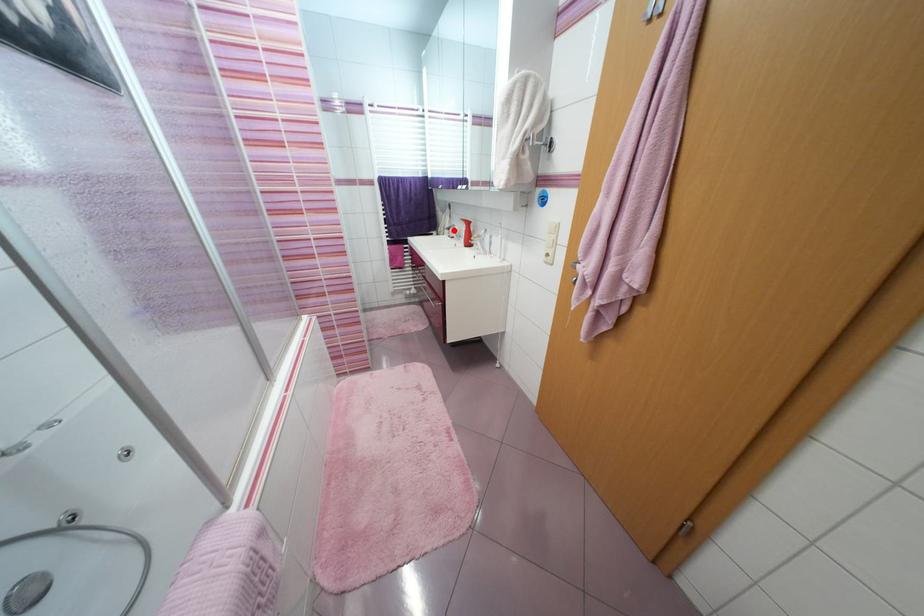
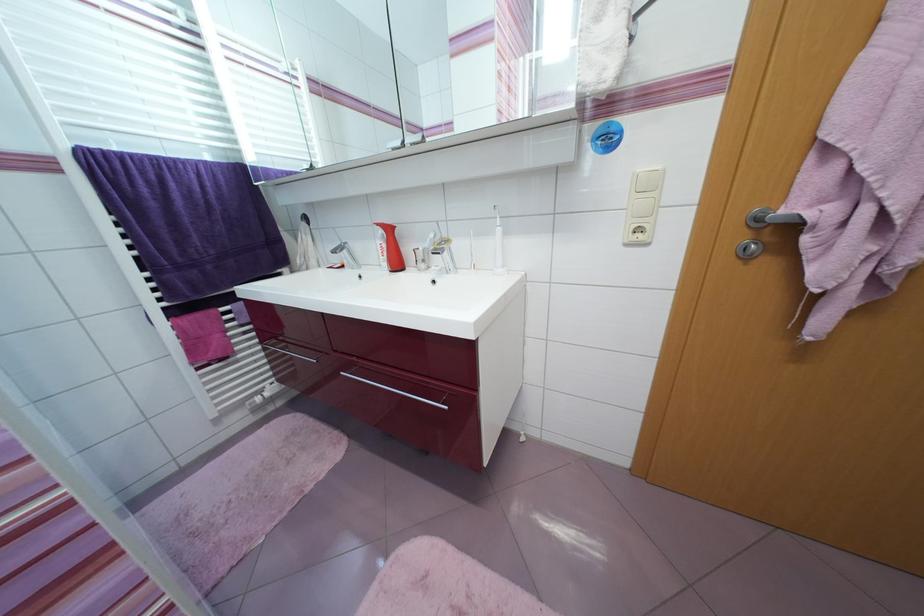
Where in the second image is the point corresponding to the highlighted location from the first image?

(338, 254)